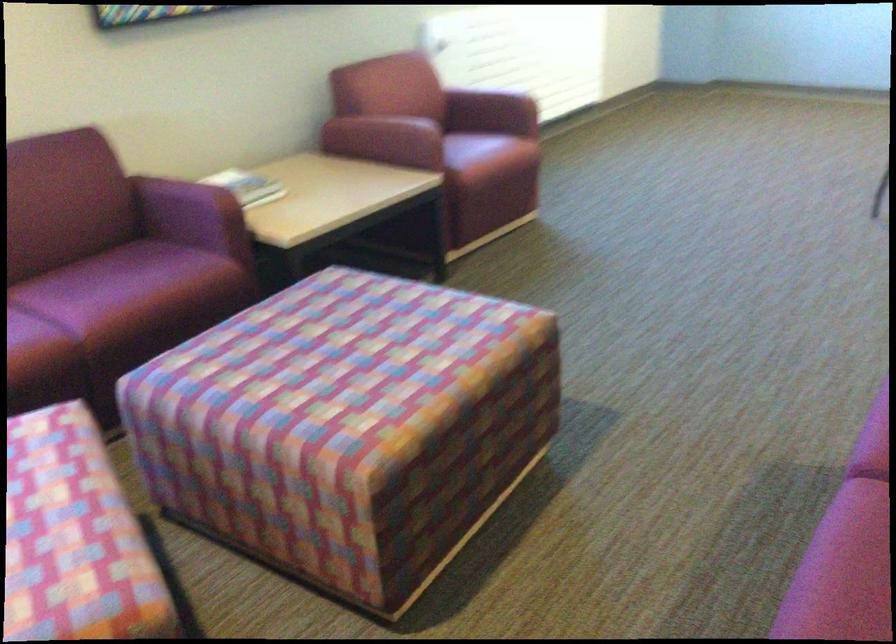
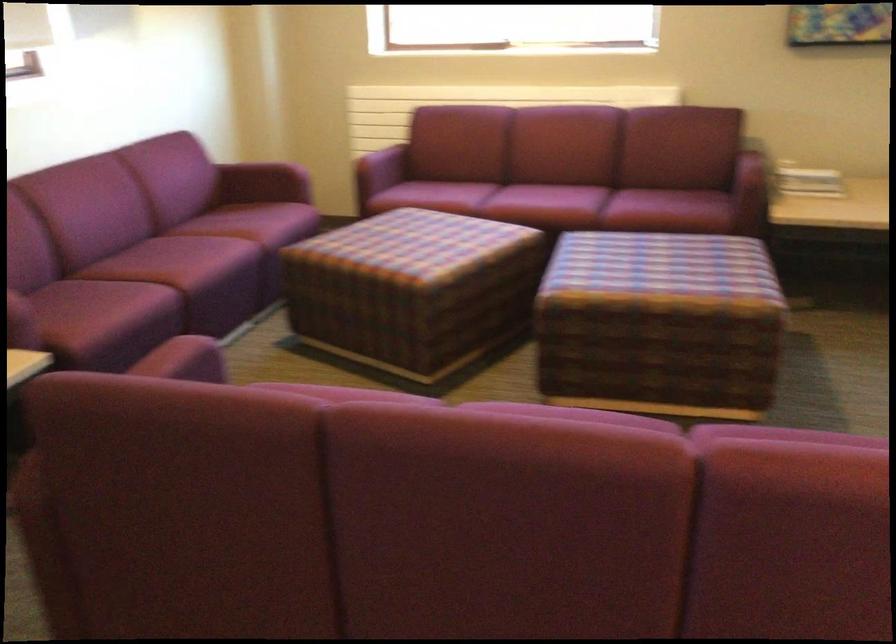
In the second image, find the point that corresponds to point (495, 406) in the first image.

(659, 324)